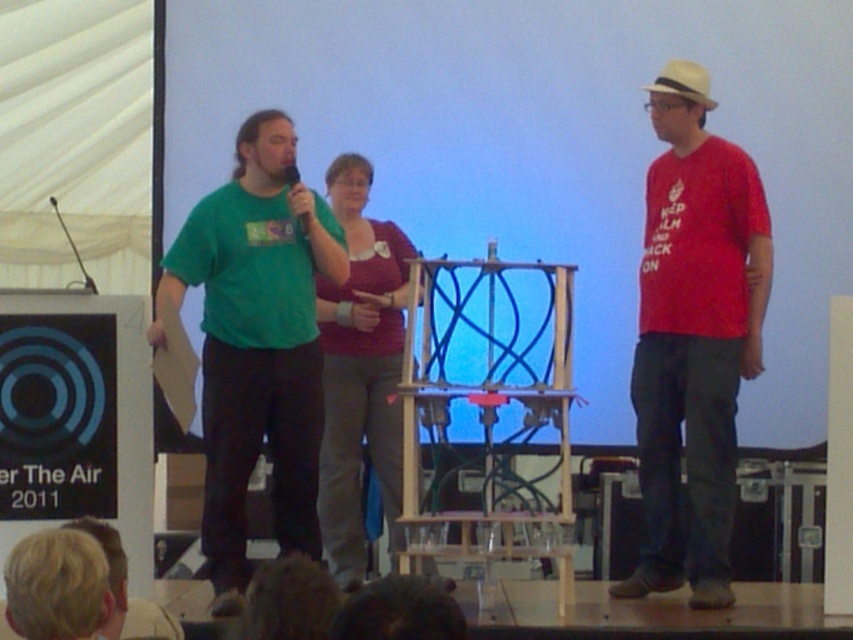
Question: Is red matte shirt at center wider than green matte t-shirt at center?

Choices:
 (A) no
 (B) yes

Answer: (A)

Question: Is blue matte projection screen at center further to camera compared to green matte t-shirt at center?

Choices:
 (A) yes
 (B) no

Answer: (A)

Question: Which of the following is the farthest from the observer?

Choices:
 (A) (364, 291)
 (B) (270, 58)
 (C) (665, 90)
 (D) (669, 346)

Answer: (B)

Question: From the image, what is the correct spatial relationship of white felt hat at upper right in relation to black matte microphone at upper center?

Choices:
 (A) left
 (B) right

Answer: (B)

Question: Among these objects, which one is nearest to the camera?

Choices:
 (A) black matte microphone at upper center
 (B) white felt hat at upper right
 (C) green matte t-shirt at center

Answer: (C)

Question: Which is farther from the red matte shirt at center?

Choices:
 (A) white felt hat at upper right
 (B) blonde hair at lower left
 (C) blue matte projection screen at center

Answer: (B)